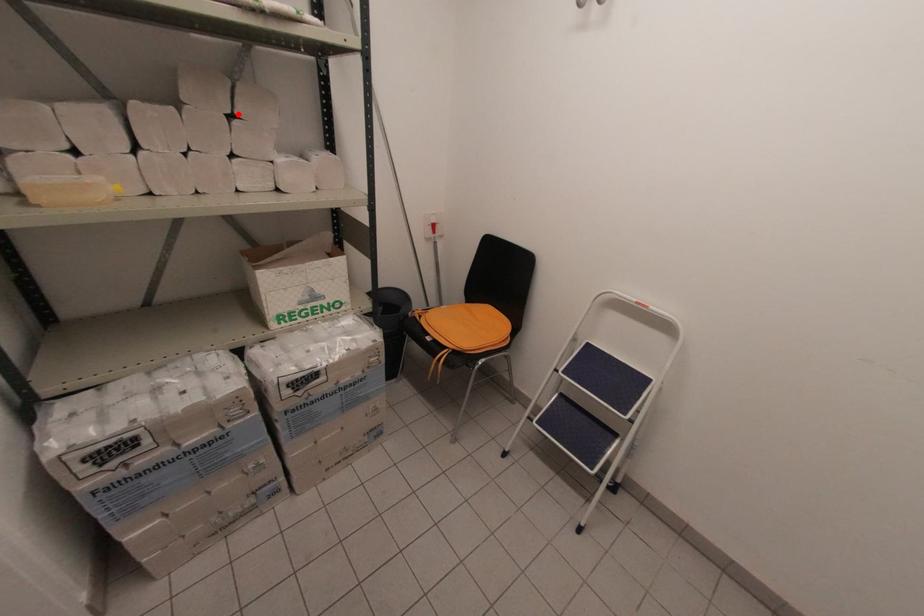
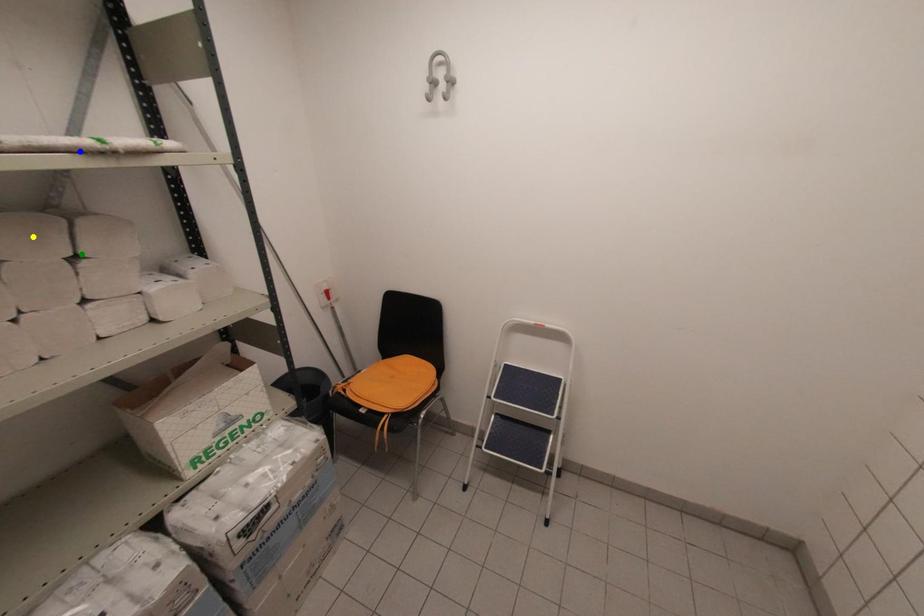
Question: I am providing you with two images of the same scene from different viewpoints. A red point is marked on the first image. You are given multiple points on the second image. Which spot in image 2 lines up with the point in image 1?

Choices:
 (A) blue point
 (B) yellow point
 (C) green point

Answer: (C)